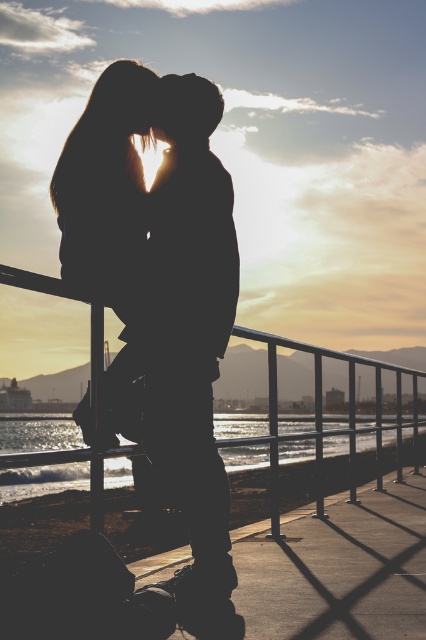
You are a photographer trying to capture the sunset scene. You notice the silhouette figure at center and the glistening water at lower left. Which object is closer to the camera based on their positions?

The silhouette figure at center is positioned over the glistening water at lower left, so the silhouette figure at center is closer to the camera than the glistening water at lower left.

You are a photographer trying to capture the sunset scene. You notice the silhouette figure at center and the metallic silver rail at center. Based on their positions, which object is closer to the camera?

The silhouette figure at center is closer to the camera because it is positioned above the metallic silver rail at center, indicating it is in front of the rail in the scene.

You are a photographer trying to capture the sunset scene. You notice the silhouette figure at center and the metallic silver rail at center. Which object appears shorter in the photo?

The silhouette figure at center appears shorter than the metallic silver rail at center because the silhouette figure at center is not as tall as the metallic silver rail at center.